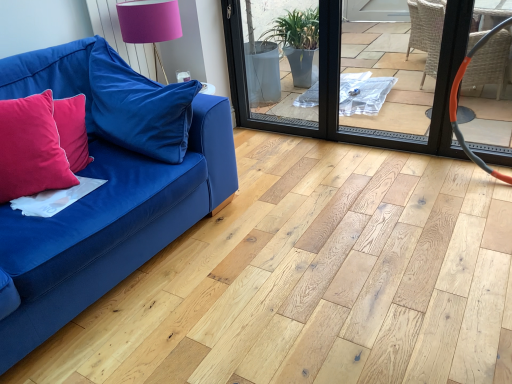
Question: Is velvet blue couch at left situated inside velvet blue pillow at left, arranged as the first pillow when viewed from the right, or outside?

Choices:
 (A) inside
 (B) outside

Answer: (B)

Question: From the image's perspective, is velvet blue couch at left located above or below velvet blue pillow at left, the second pillow viewed from the left?

Choices:
 (A) above
 (B) below

Answer: (B)

Question: Which object is positioned closest to the velvet blue couch at left?

Choices:
 (A) pink fabric lampshade at upper center
 (B) orange rubber hose at right
 (C) transparent plastic screen door at center
 (D) velvet red pillow at left, the second pillow in the right-to-left sequence
 (E) velvet blue pillow at left, the second pillow viewed from the left

Answer: (E)

Question: Which object is positioned farthest from the orange rubber hose at right?

Choices:
 (A) transparent plastic screen door at center
 (B) velvet blue pillow at left, arranged as the first pillow when viewed from the right
 (C) velvet blue couch at left
 (D) velvet red pillow at left, the 1th pillow in the left-to-right sequence
 (E) pink fabric lampshade at upper center

Answer: (D)